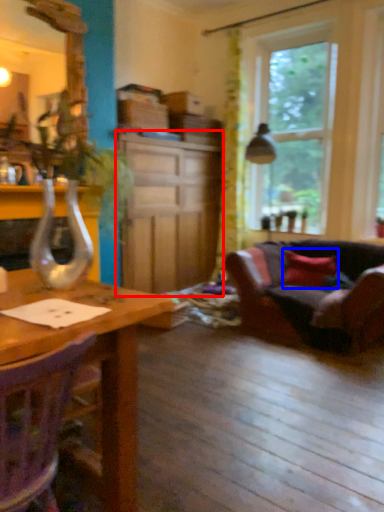
Question: Which object appears closest to the camera in this image, cabinetry (highlighted by a red box) or pillow (highlighted by a blue box)?

Choices:
 (A) cabinetry
 (B) pillow

Answer: (A)